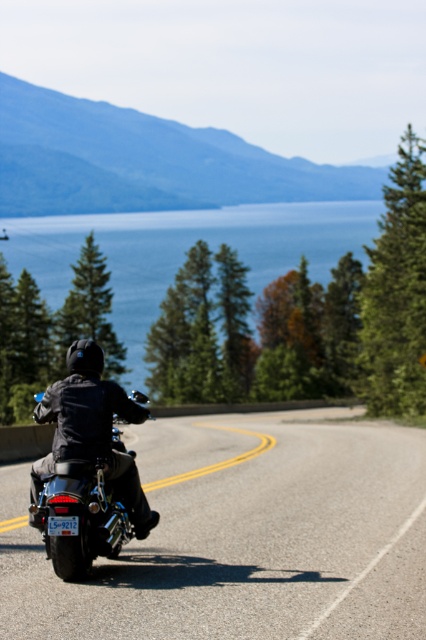
You are a tourist planning to take a photo of the black rubber motorcycle at center and the blue water at center from a viewpoint ahead. Which object will appear closer to you in the photo?

The black rubber motorcycle at center will appear closer to you in the photo because it is positioned under the blue water at center, meaning it is physically nearer to the camera viewpoint.

You are a photographer aiming to capture both the black rubber motorcycle at center and the shiny chrome motorcycle at center in a single shot. Which motorcycle should you focus on first to ensure both are in frame?

You should focus on the shiny chrome motorcycle at center first because the black rubber motorcycle at center is positioned under it, so adjusting the camera angle to include the lower motorcycle will naturally include the upper one as well.

You are the motorcyclist on the black motorcycle with license plate L59212. You see two points on your path ahead. The first is at point (x=328, y=204) and the second at point (x=54, y=536). Which point will you reach first?

The point at (x=54, y=536) will be reached first because it is in front of the point at (x=328, y=204) along the road.